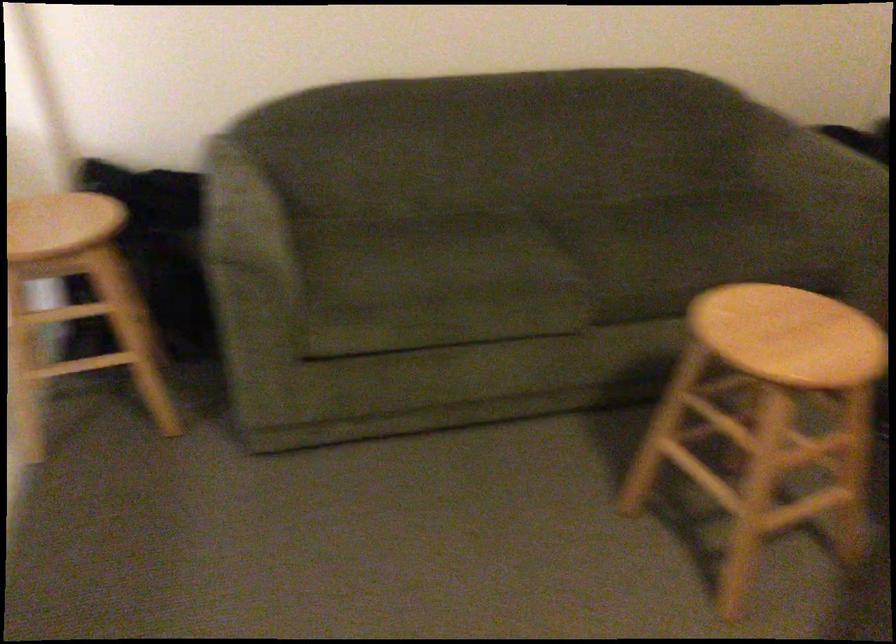
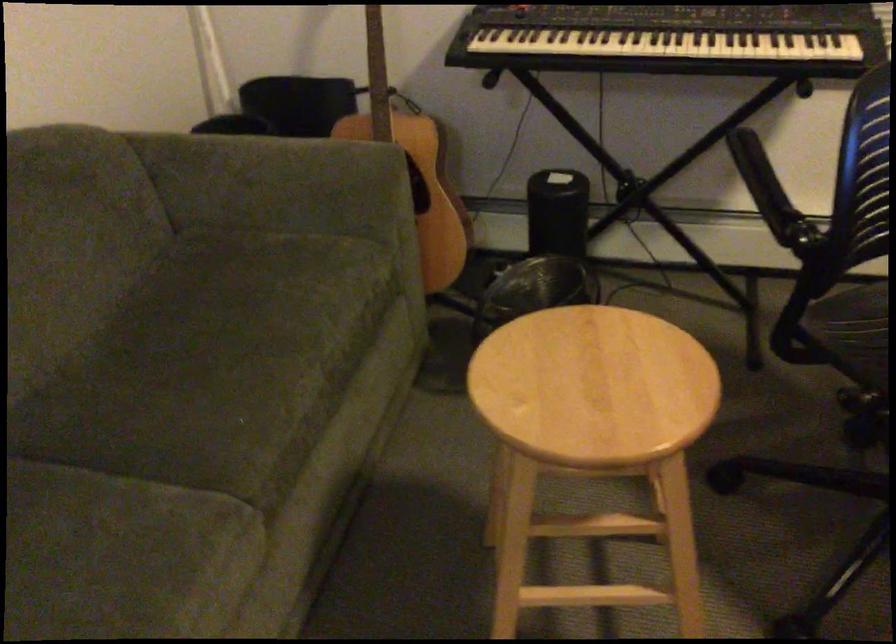
In the second image, find the point that corresponds to point 659,230 in the first image.

(211, 351)